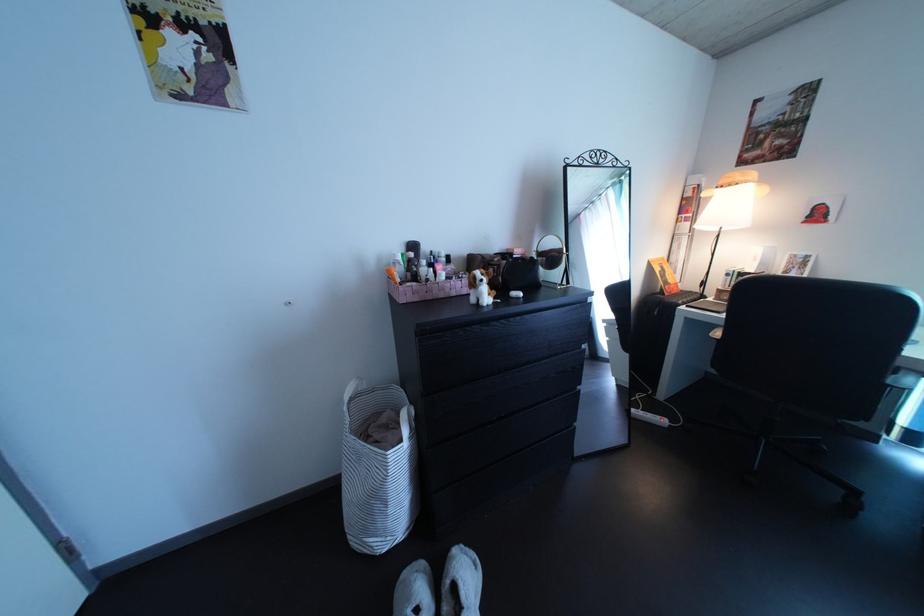
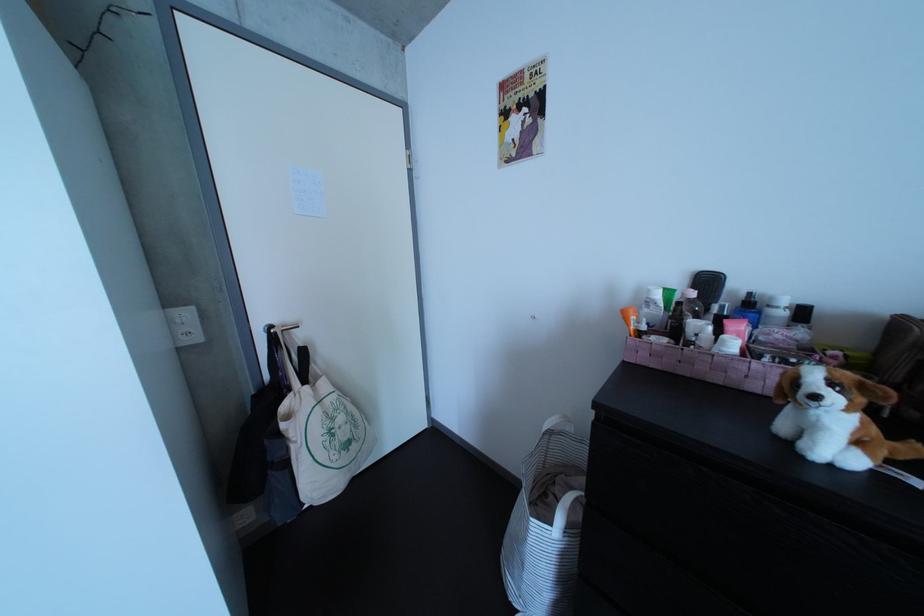
Question: The first image is from the beginning of the video and the second image is from the end. How did the camera likely rotate when shooting the video?

Choices:
 (A) Left
 (B) Right
 (C) Up
 (D) Down

Answer: (A)